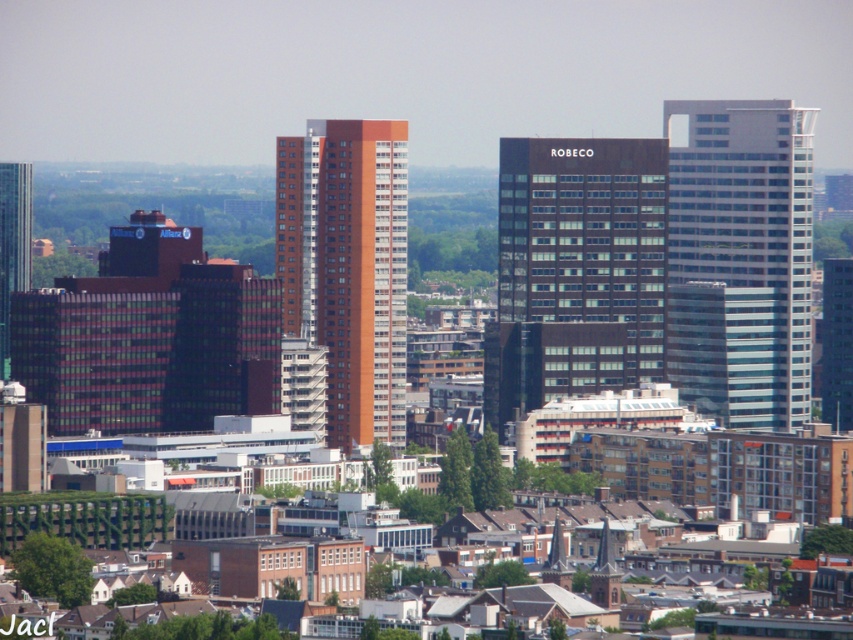
You are standing in the city square and want to take a photo of the dark glass building at center and the green glass skyscraper at left. Which building should you focus on first if you want to capture both in a single frame without moving the camera?

You should focus on the dark glass building at center first because it is closer to you than the green glass skyscraper at left, so adjusting the focus to the closer building will ensure both are in the frame.

You are standing in the city square and want to take a photo of both the dark glass building at center and the brown matte building at center. Which building should you focus on first to ensure both are in the frame?

You should focus on the dark glass building at center first because it is closer to you than the brown matte building at center, allowing both to be captured in the frame.

You are a drone operator who needs to fly a drone between the dark glass building at center and the green glass skyscraper at left. The drone has a maximum flight distance of 350 feet. Can the drone safely fly between them without exceeding its range?

The dark glass building at center and the green glass skyscraper at left are 364.42 feet apart from each other. Since the drone can only fly up to 350 feet, it cannot safely fly between them without exceeding its range.